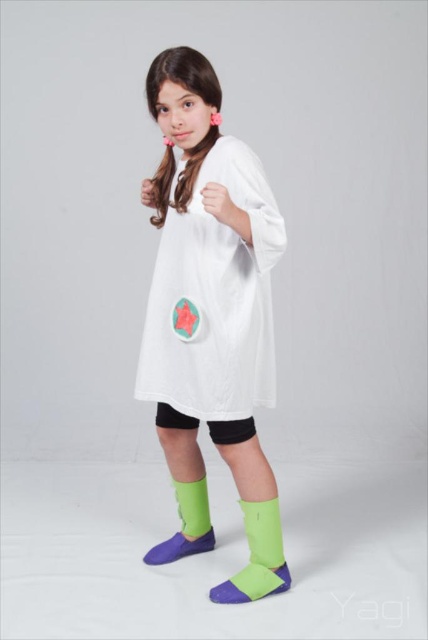
Question: Is white matte dress at center closer to camera compared to green fabric sock at lower center?

Choices:
 (A) yes
 (B) no

Answer: (A)

Question: Considering the real-world distances, which object is farthest from the green fabric boot at lower center?

Choices:
 (A) white matte dress at center
 (B) green matte boot at lower center

Answer: (A)

Question: Does green matte boot at lower center have a smaller size compared to green fabric sock at lower center?

Choices:
 (A) yes
 (B) no

Answer: (B)

Question: Which is farther from the green matte boot at lower center?

Choices:
 (A) green fabric boot at lower center
 (B) green fabric sock at lower center

Answer: (B)

Question: Does green matte boot at lower center have a lesser width compared to green fabric boot at lower center?

Choices:
 (A) yes
 (B) no

Answer: (B)

Question: Which point appears farthest from the camera in this image?

Choices:
 (A) (275, 508)
 (B) (166, 189)
 (C) (193, 500)

Answer: (C)